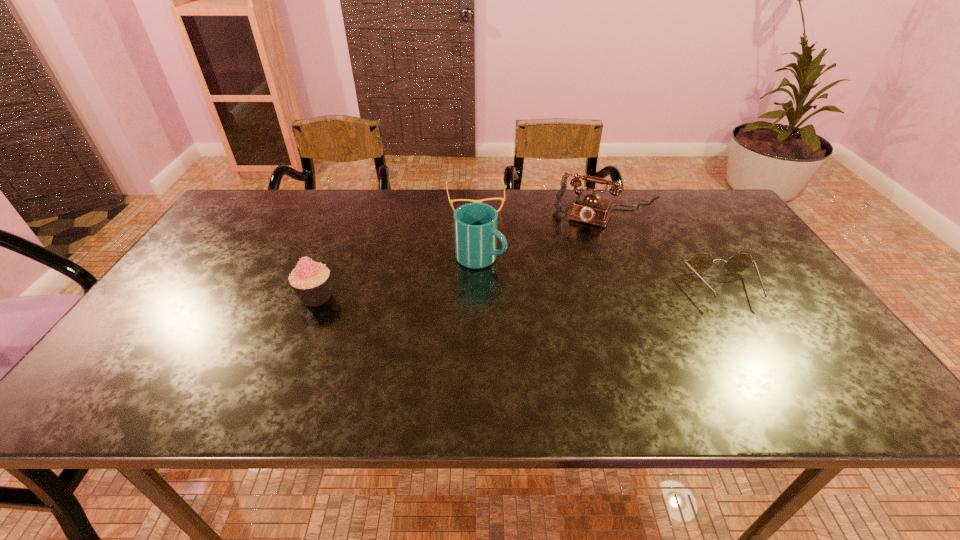
Identify the location of free spot between the shorter spectacles and the taller spectacles. Image resolution: width=960 pixels, height=540 pixels. (599, 245).

Where is `vacant space that is in between the telephone and the second shortest object`? The image size is (960, 540). vacant space that is in between the telephone and the second shortest object is located at coordinates (668, 249).

In order to click on object that is the fourth closest to the farther spectacles in this screenshot , I will do pyautogui.click(x=701, y=262).

Point out which object is positioned as the third nearest to the cup. Please provide its 2D coordinates. Your answer should be formatted as a tuple, i.e. [(x, y)], where the tuple contains the x and y coordinates of a point satisfying the conditions above.

[(310, 280)]

Identify the location of vacant region that satisfies the following two spatial constraints: 1. on the back side of the cupcake; 2. on the right side of the third nearest object. (332, 257).

I want to click on vacant point that satisfies the following two spatial constraints: 1. on the front side of the telephone; 2. on the left side of the shorter spectacles, so click(x=474, y=211).